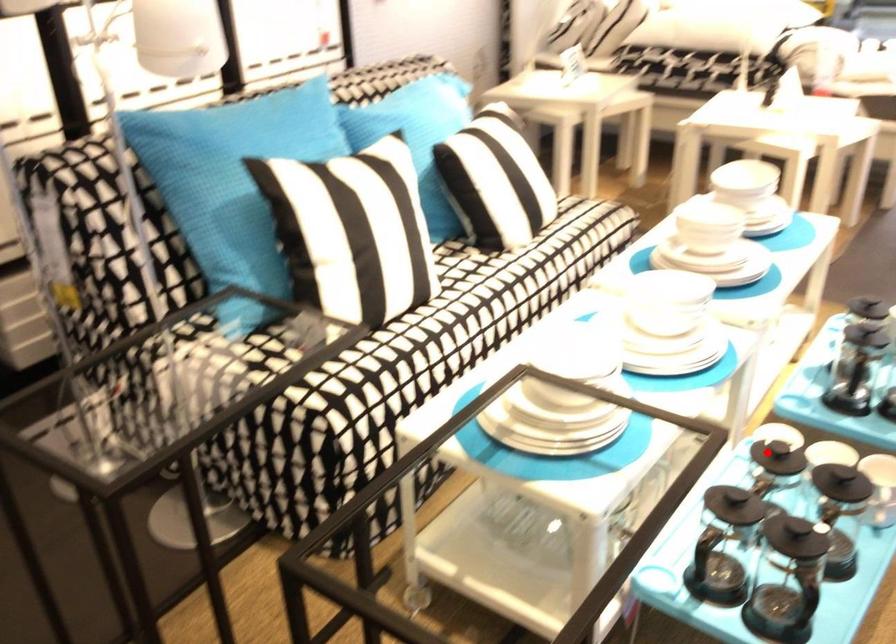
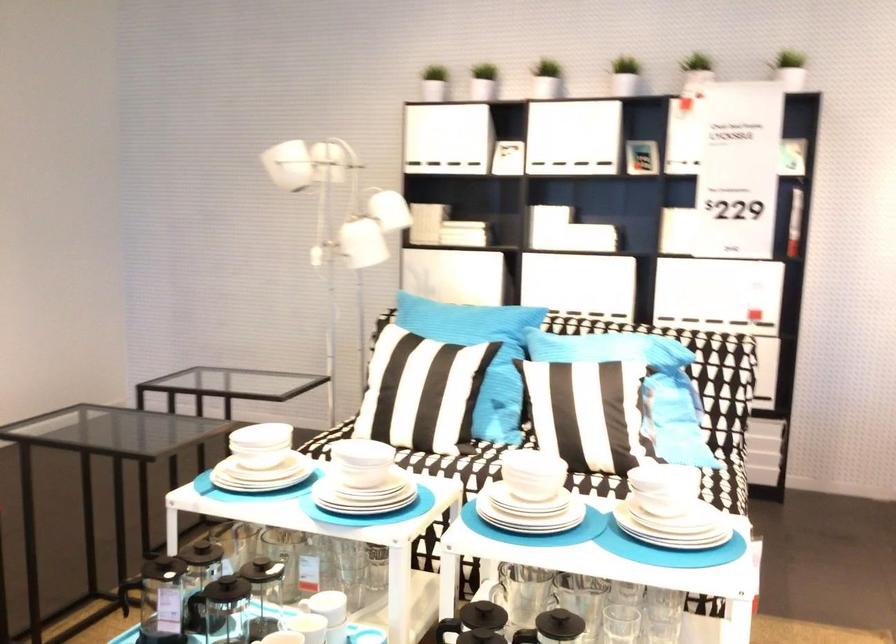
In the second image, find the point that corresponds to the highlighted location in the first image.

(329, 605)